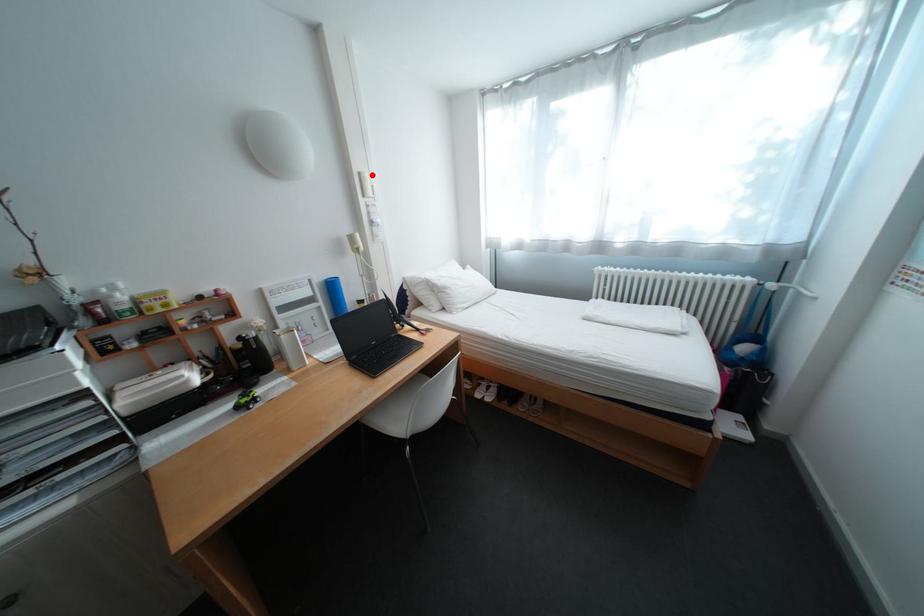
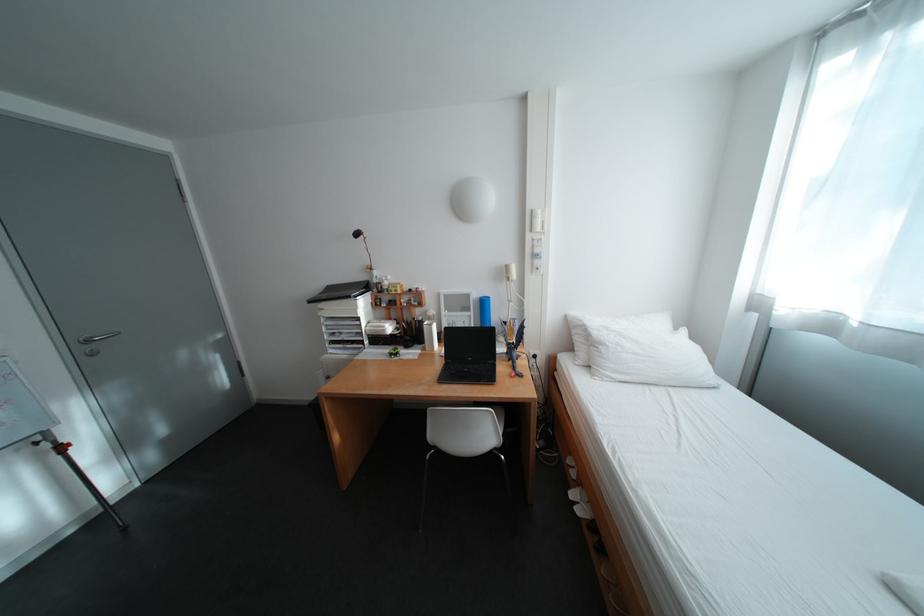
Where in the second image is the point corresponding to the highlighted location from the first image?

(544, 213)